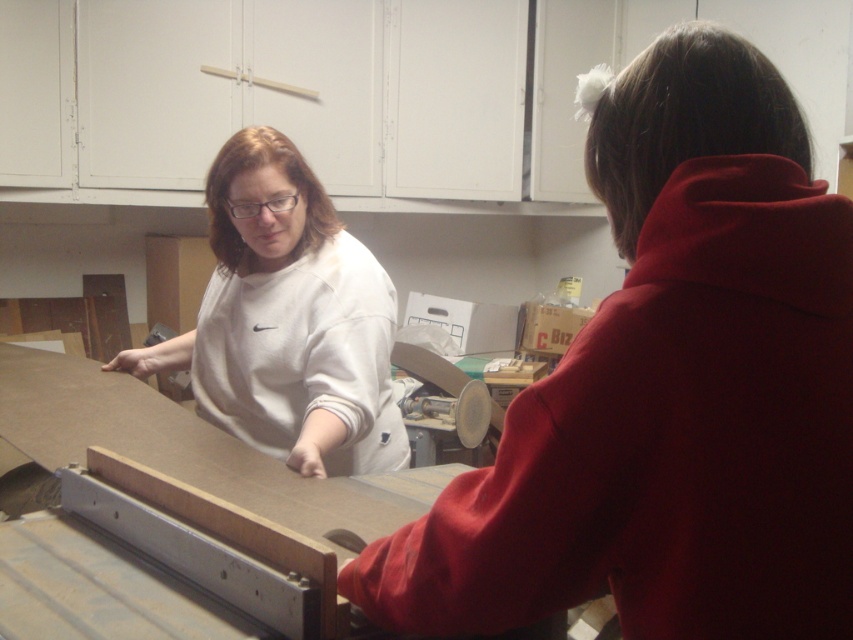
Consider the image. Which is more to the left, white matte sweatshirt at upper left or white matte sweatshirt at center?

white matte sweatshirt at center

Who is lower down, white matte sweatshirt at upper left or white matte sweatshirt at center?

Positioned lower is white matte sweatshirt at upper left.

Consider the image. Who is more forward, (755,572) or (268,328)?

Positioned in front is point (755,572).

Find the location of a particular element. The image size is (853, 640). white matte sweatshirt at upper left is located at coordinates (669, 390).